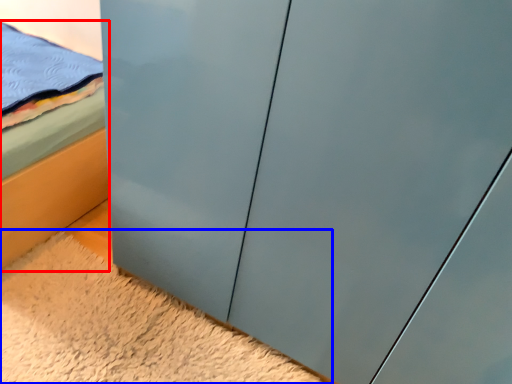
Question: Among these objects, which one is farthest to the camera, bed (highlighted by a red box) or plain (highlighted by a blue box)?

Choices:
 (A) bed
 (B) plain

Answer: (A)